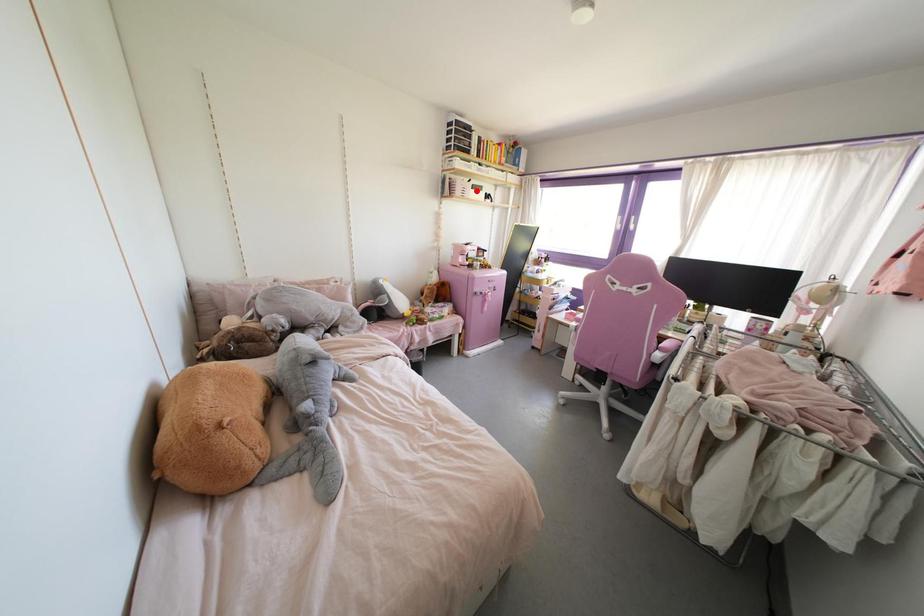
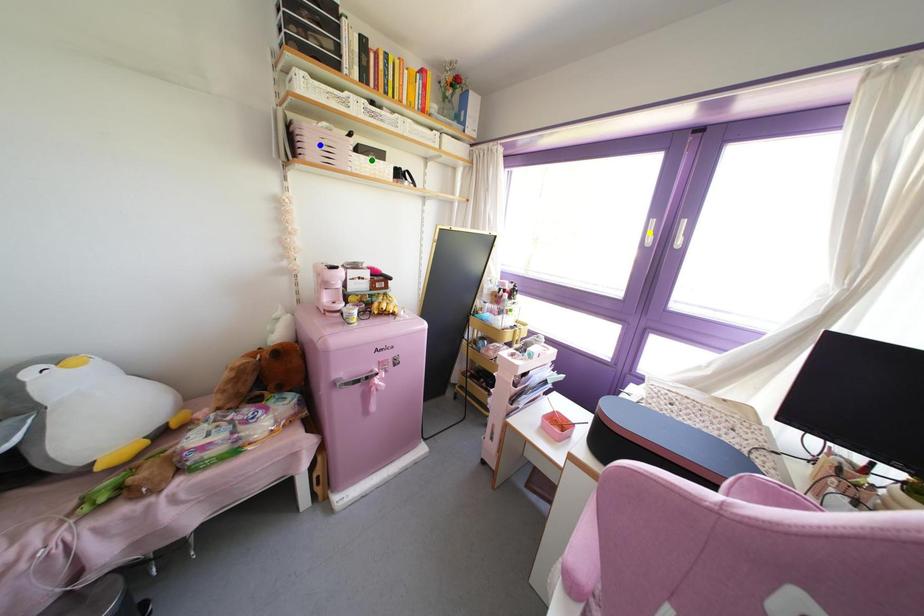
Question: I am providing you with two images of the same scene from different viewpoints. A red point is marked on the first image. You are given multiple points on the second image. In image 2, which mark is for the same physical point as the one in image 1?

Choices:
 (A) blue point
 (B) green point
 (C) yellow point

Answer: (B)